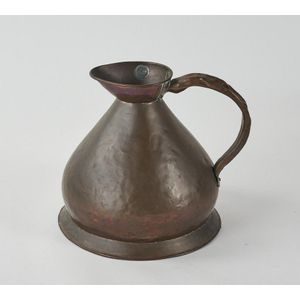
At what (x,y) coordinates should I click in order to perform the action: click on handle. Please return your answer as a coordinate pair (x, y). Image resolution: width=300 pixels, height=300 pixels. Looking at the image, I should click on (238, 97).